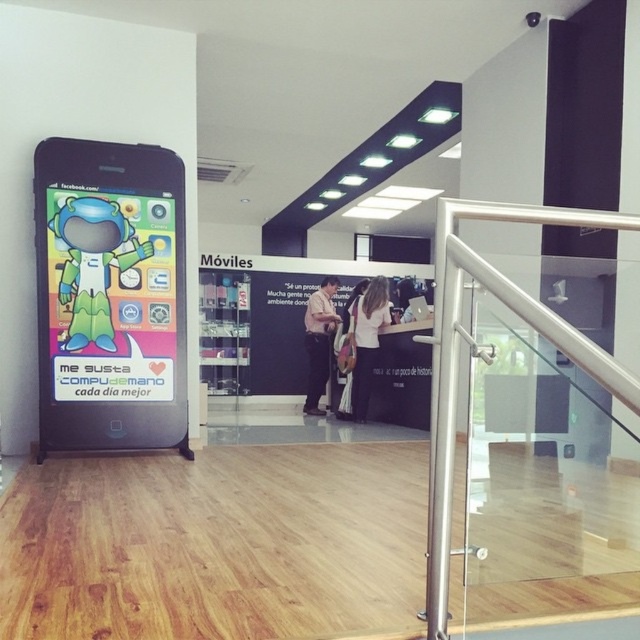
Is silver/glass railing at right shorter than light brown leather shirt at center?

Yes, silver/glass railing at right is shorter than light brown leather shirt at center.

Is silver/glass railing at right taller than light brown leather shirt at center?

No, silver/glass railing at right is not taller than light brown leather shirt at center.

Where is `silver/glass railing at right`? The width and height of the screenshot is (640, 640). silver/glass railing at right is located at coordinates (467, 337).

Describe the element at coordinates (109, 296) in the screenshot. This screenshot has width=640, height=640. I see `matte black smartphone at left` at that location.

Find the location of a particular element. matte black smartphone at left is located at coordinates (109, 296).

Is white matte shirt at center wider than light brown leather shirt at center?

Correct, the width of white matte shirt at center exceeds that of light brown leather shirt at center.

Is point (358, 308) more distant than point (317, 376)?

No.

Locate an element on the screen. white matte shirt at center is located at coordinates (365, 340).